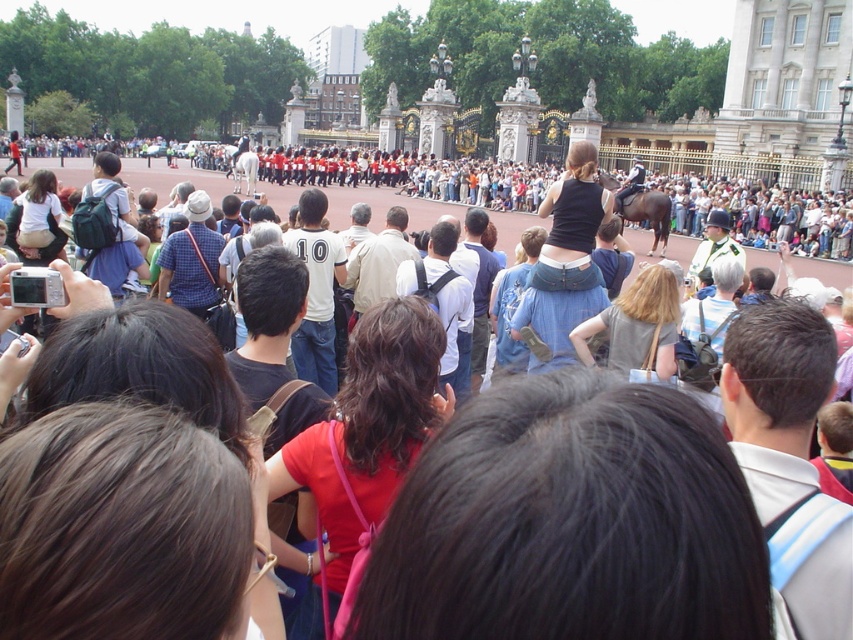
You are a photographer standing in the crowd at Buckingham Palace. You notice two people in front of you wearing a gray fabric shirt at center and a matte white shirt at center. Which shirt is larger?

The matte white shirt at center is larger than the gray fabric shirt at center.

From the picture: You are a photographer trying to capture the guards marching at Buckingham Palace. You notice two people in the crowd wearing a matte red shirt at center and a matte white shirt at center. Which shirt do you need to focus on to ensure it appears bigger in your photo?

The matte red shirt at center has a larger size compared to the matte white shirt at center, so focusing on the matte red shirt at center will ensure it appears bigger in your photo.

You are a photographer standing at the camera position and want to capture a closeup shot of the gray fabric shirt at center. Considering the distance, is it possible to do so without moving closer?

The gray fabric shirt at center is 66.24 meters away from the camera, so it would be difficult to capture a closeup shot without moving closer or using a telephoto lens.